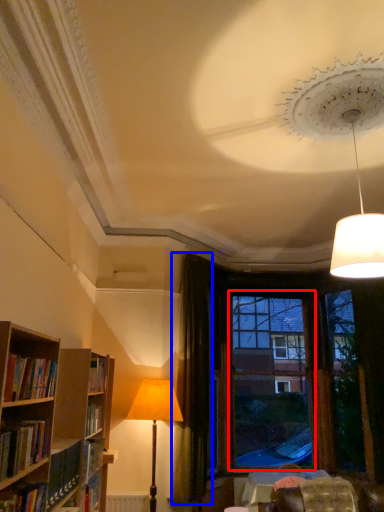
Question: Which object appears closest to the camera in this image, window frame (highlighted by a red box) or curtain (highlighted by a blue box)?

Choices:
 (A) window frame
 (B) curtain

Answer: (B)